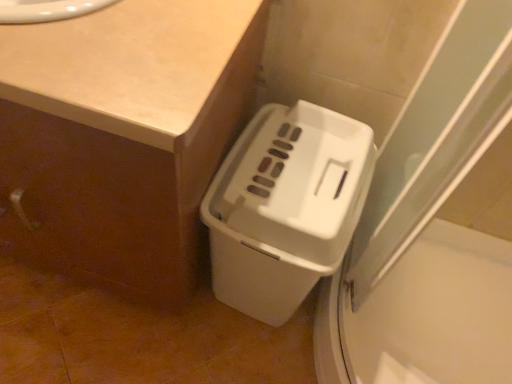
Question: Does white plastic waste container at lower right appear on the right side of beige laminate counter at upper left?

Choices:
 (A) yes
 (B) no

Answer: (A)

Question: Is white plastic waste container at lower right further to the viewer compared to beige laminate counter at upper left?

Choices:
 (A) no
 (B) yes

Answer: (B)

Question: From a real-world perspective, is white plastic waste container at lower right physically above beige laminate counter at upper left?

Choices:
 (A) no
 (B) yes

Answer: (A)

Question: Is white plastic waste container at lower right outside beige laminate counter at upper left?

Choices:
 (A) no
 (B) yes

Answer: (B)

Question: Is there a large distance between white plastic waste container at lower right and beige laminate counter at upper left?

Choices:
 (A) yes
 (B) no

Answer: (B)

Question: Is white plastic waste container at lower right surrounding beige laminate counter at upper left?

Choices:
 (A) no
 (B) yes

Answer: (A)

Question: Does white matte counter at lower right have a greater width compared to white plastic waste container at lower right?

Choices:
 (A) no
 (B) yes

Answer: (B)

Question: Is white matte counter at lower right in front of white plastic waste container at lower right?

Choices:
 (A) no
 (B) yes

Answer: (B)

Question: Does white matte counter at lower right appear on the right side of white plastic waste container at lower right?

Choices:
 (A) yes
 (B) no

Answer: (B)

Question: Does white matte counter at lower right have a larger size compared to white plastic waste container at lower right?

Choices:
 (A) yes
 (B) no

Answer: (A)

Question: From the image's perspective, is white matte counter at lower right on top of white plastic waste container at lower right?

Choices:
 (A) yes
 (B) no

Answer: (A)

Question: Does white matte counter at lower right have a smaller size compared to white plastic waste container at lower right?

Choices:
 (A) no
 (B) yes

Answer: (A)

Question: Does beige laminate counter at upper left have a greater height compared to white matte counter at lower right?

Choices:
 (A) yes
 (B) no

Answer: (B)